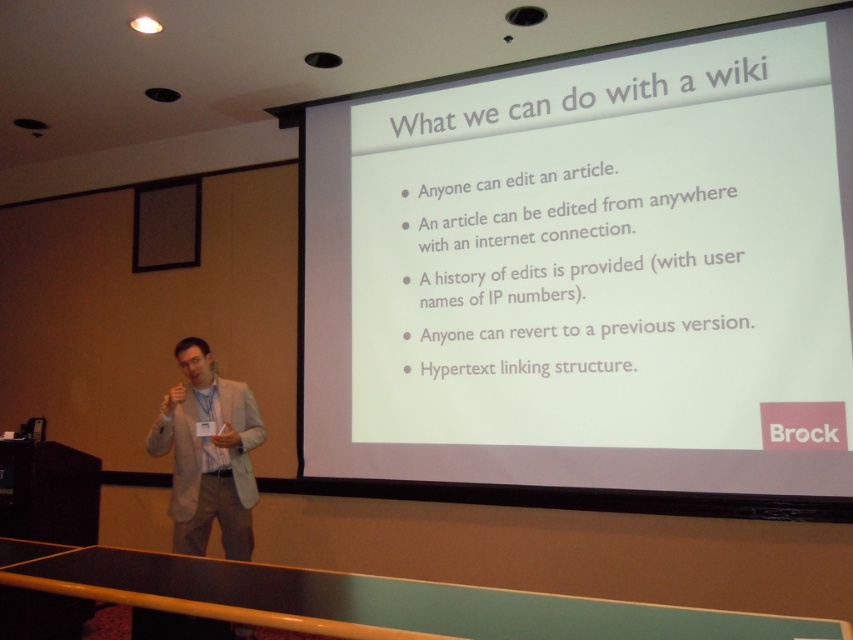
Does white matte projector screen at upper center have a greater width compared to light gray suit at center?

Yes.

Does white matte projector screen at upper center have a smaller size compared to light gray suit at center?

No.

Does point (350, 113) come in front of point (160, 433)?

No, it is behind (160, 433).

Where is `white matte projector screen at upper center`? white matte projector screen at upper center is located at coordinates click(589, 269).